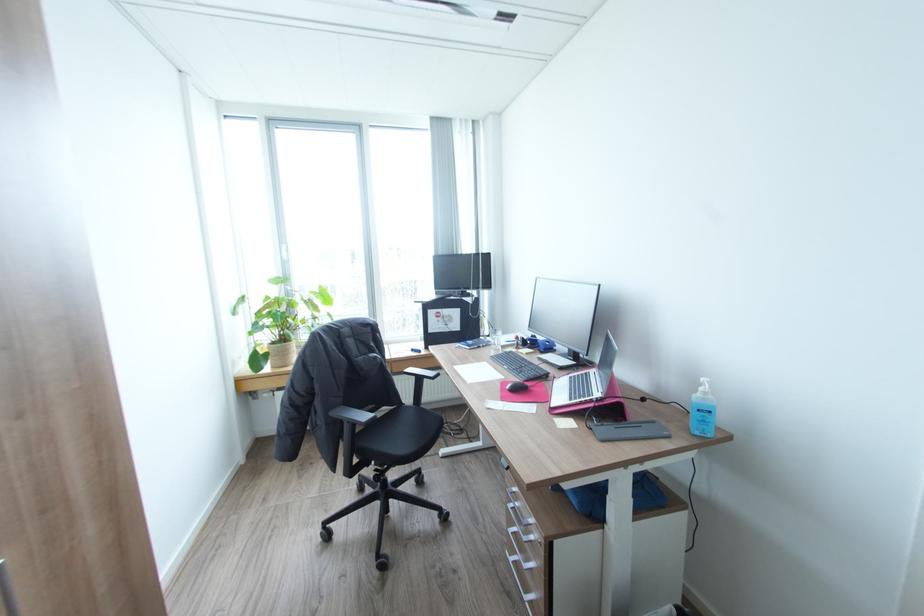
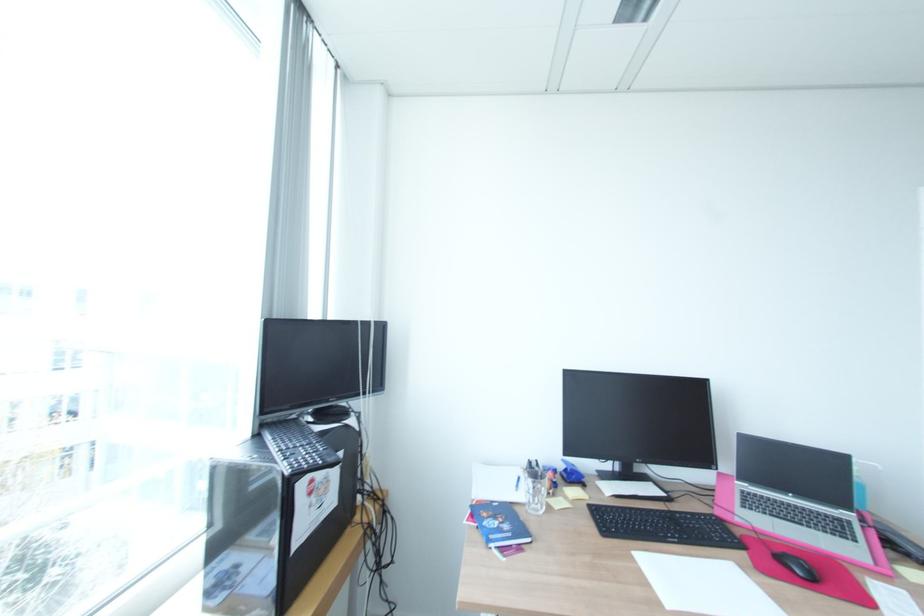
Where in the second image is the point corresponding to [576,381] from the first image?

(770, 513)